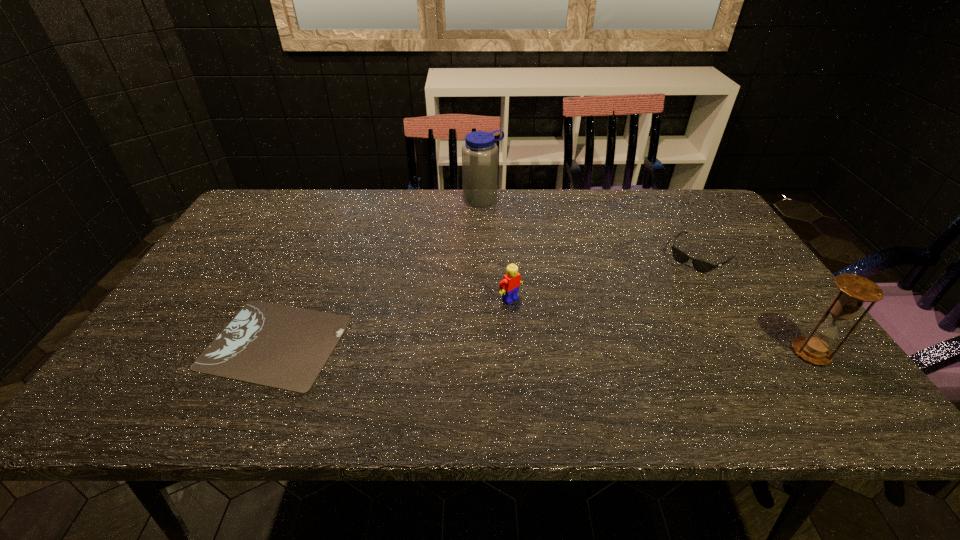
The height and width of the screenshot is (540, 960). Find the location of `vacant space at the far left corner of the desktop`. vacant space at the far left corner of the desktop is located at coordinates (276, 225).

Image resolution: width=960 pixels, height=540 pixels. What are the coordinates of `blank space at the near left corner` in the screenshot? It's located at (161, 350).

Identify the location of vacant space at the near right corner of the desktop. This screenshot has width=960, height=540. (780, 370).

The image size is (960, 540). What are the coordinates of `empty location between the hourglass and the third tallest object` in the screenshot? It's located at (660, 326).

This screenshot has width=960, height=540. What are the coordinates of `empty space that is in between the Lego and the sunglasses` in the screenshot? It's located at (606, 277).

Find the location of a particular element. The height and width of the screenshot is (540, 960). vacant point located between the hourglass and the farthest object is located at coordinates (647, 276).

This screenshot has width=960, height=540. What are the coordinates of `free space between the mousepad and the Lego` in the screenshot? It's located at (393, 321).

Image resolution: width=960 pixels, height=540 pixels. I want to click on free spot between the farthest object and the mousepad, so click(x=379, y=271).

Where is `free space that is in between the water bottle and the leftmost object`? The width and height of the screenshot is (960, 540). free space that is in between the water bottle and the leftmost object is located at coordinates (379, 271).

Find the location of `vacant area that lies between the hourglass and the fourth tallest object`. vacant area that lies between the hourglass and the fourth tallest object is located at coordinates (756, 304).